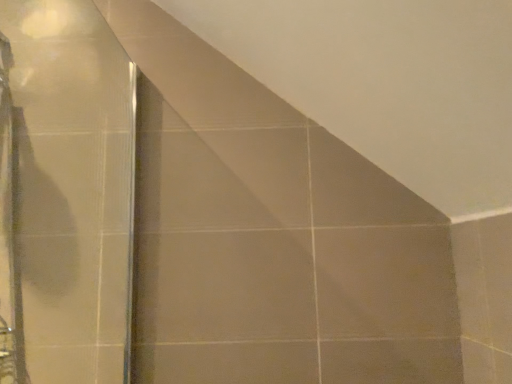
Find the location of a particular element. This screenshot has width=512, height=384. transparent glass door at left is located at coordinates (65, 195).

In order to face transparent glass door at left, should I rotate leftwards or rightwards?

It's best to rotate left around 31.560 degrees.

The height and width of the screenshot is (384, 512). What do you see at coordinates (65, 195) in the screenshot? I see `transparent glass door at left` at bounding box center [65, 195].

Locate an element on the screen. Image resolution: width=512 pixels, height=384 pixels. transparent glass door at left is located at coordinates (65, 195).